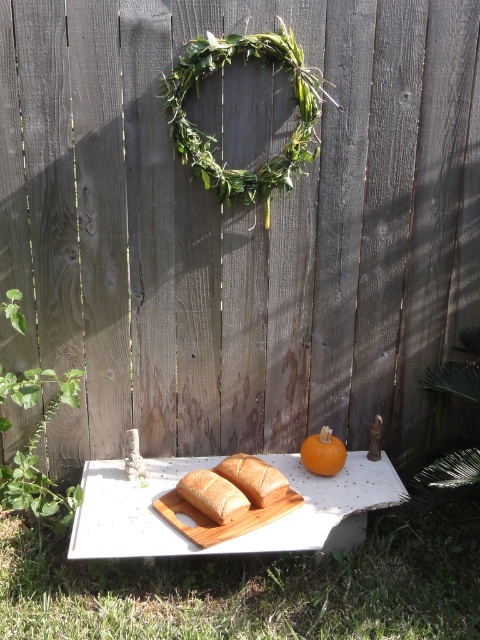
Question: Which point is farther to the camera?

Choices:
 (A) white painted wood table at center
 (B) orange matte pumpkin at center
 (C) golden brown bread at center

Answer: (B)

Question: Is white painted wood table at center bigger than golden brown bread at center?

Choices:
 (A) no
 (B) yes

Answer: (B)

Question: Is white painted wood table at center bigger than golden brown bread at center?

Choices:
 (A) no
 (B) yes

Answer: (B)

Question: Which point is farther to the camera?

Choices:
 (A) white painted wood table at center
 (B) white matte bread at center

Answer: (B)

Question: Which of these objects is positioned farthest from the white matte bread at center?

Choices:
 (A) white painted wood table at center
 (B) orange matte pumpkin at center
 (C) golden brown bread at center

Answer: (B)

Question: Is white painted wood table at center bigger than white matte bread at center?

Choices:
 (A) yes
 (B) no

Answer: (A)